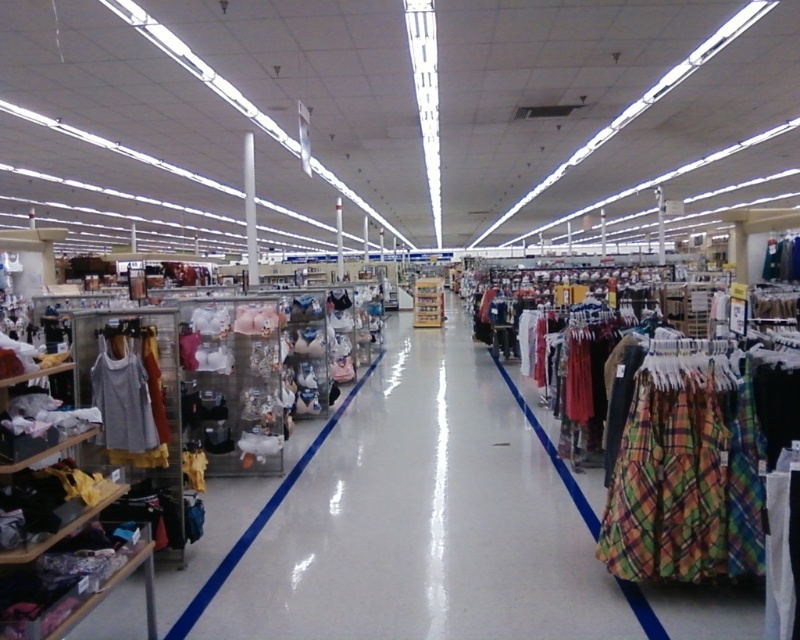
Question: Is the position of clear plastic bins at center more distant than that of light gray fabric tank top at left?

Choices:
 (A) no
 (B) yes

Answer: (A)

Question: Which point is closer to the camera?

Choices:
 (A) light gray fabric tank top at left
 (B) clear plastic bins at center

Answer: (B)

Question: Can you confirm if clear plastic bins at center is thinner than light gray fabric tank top at left?

Choices:
 (A) yes
 (B) no

Answer: (B)

Question: Can you confirm if clear plastic bins at center is wider than light gray fabric tank top at left?

Choices:
 (A) yes
 (B) no

Answer: (A)